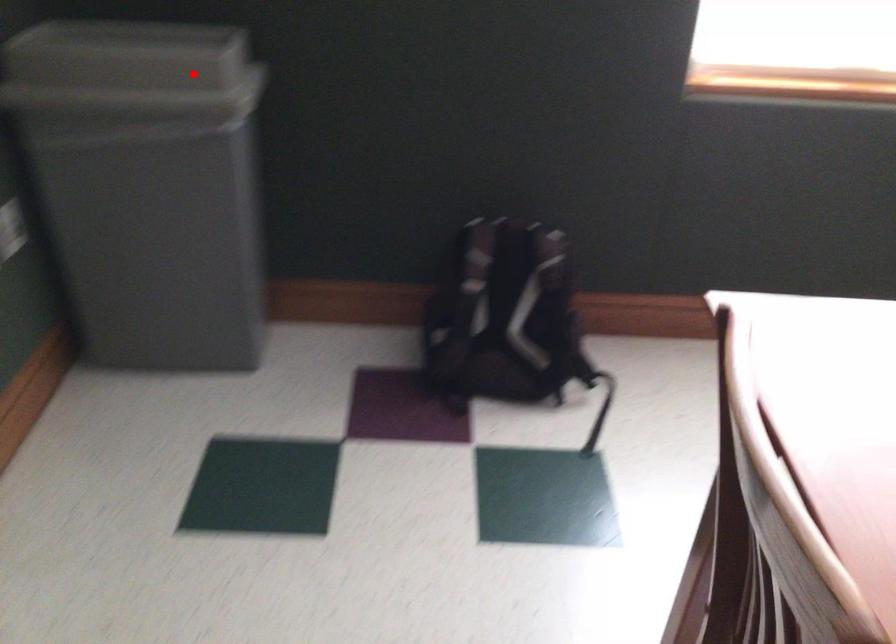
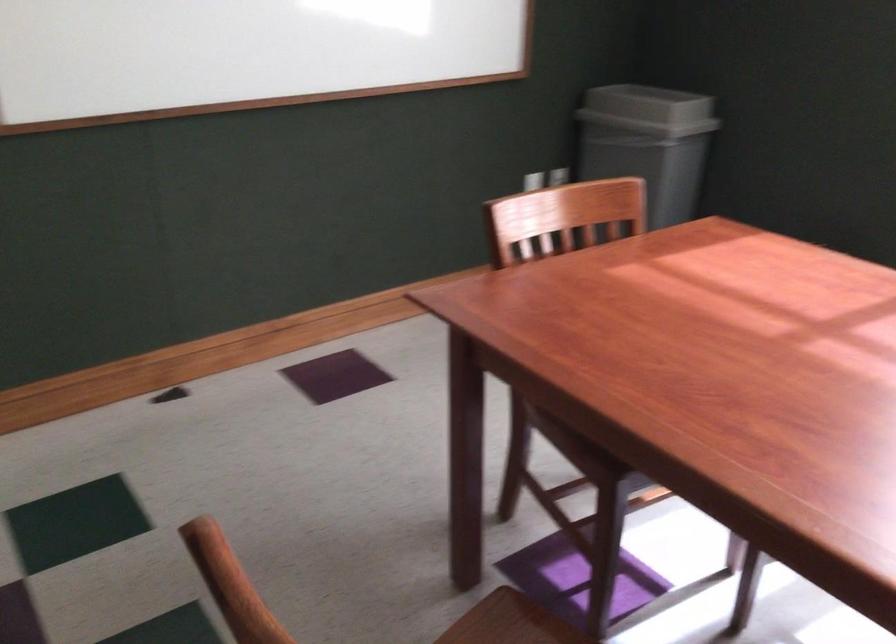
Where in the second image is the point corresponding to the highlighted location from the first image?

(648, 109)